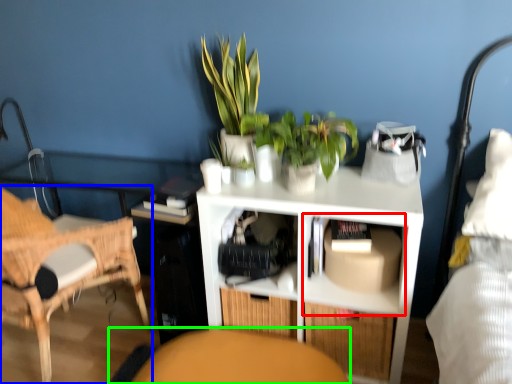
Question: Which is nearer to the cabinet (highlighted by a red box)? chair (highlighted by a blue box) or swivel chair (highlighted by a green box).

Choices:
 (A) chair
 (B) swivel chair

Answer: (B)